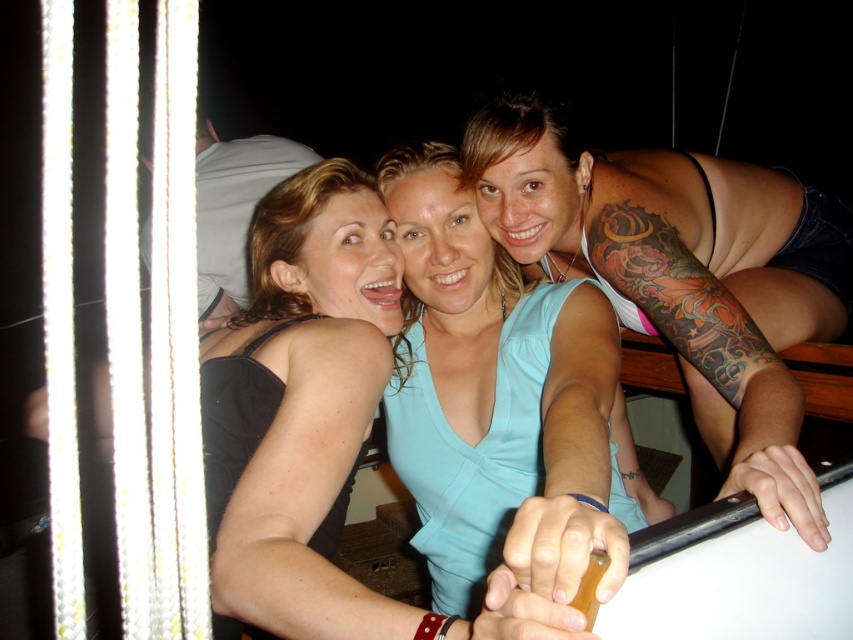
Question: Does blue fabric top at upper right appear on the left side of light blue fabric at center?

Choices:
 (A) no
 (B) yes

Answer: (A)

Question: Is blue fabric top at upper right in front of light blue fabric at center?

Choices:
 (A) yes
 (B) no

Answer: (B)

Question: Observing the image, what is the correct spatial positioning of blue fabric top at upper right in reference to light blue fabric at center?

Choices:
 (A) below
 (B) above

Answer: (B)

Question: Which point is farther to the camera?

Choices:
 (A) (511, 336)
 (B) (711, 296)

Answer: (A)